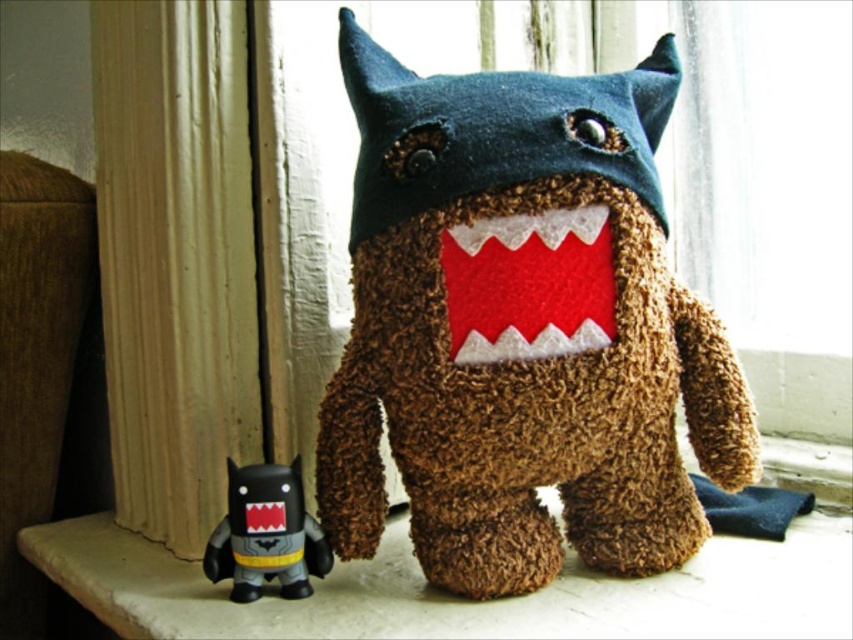
Question: Is brown fuzzy stuffed toy at center smaller than matte black toy at lower left?

Choices:
 (A) no
 (B) yes

Answer: (A)

Question: Is brown fuzzy stuffed toy at center positioned behind matte black toy at lower left?

Choices:
 (A) yes
 (B) no

Answer: (B)

Question: Is brown fuzzy stuffed toy at center smaller than matte black toy at lower left?

Choices:
 (A) yes
 (B) no

Answer: (B)

Question: Among these points, which one is nearest to the camera?

Choices:
 (A) (465, 374)
 (B) (265, 579)

Answer: (A)